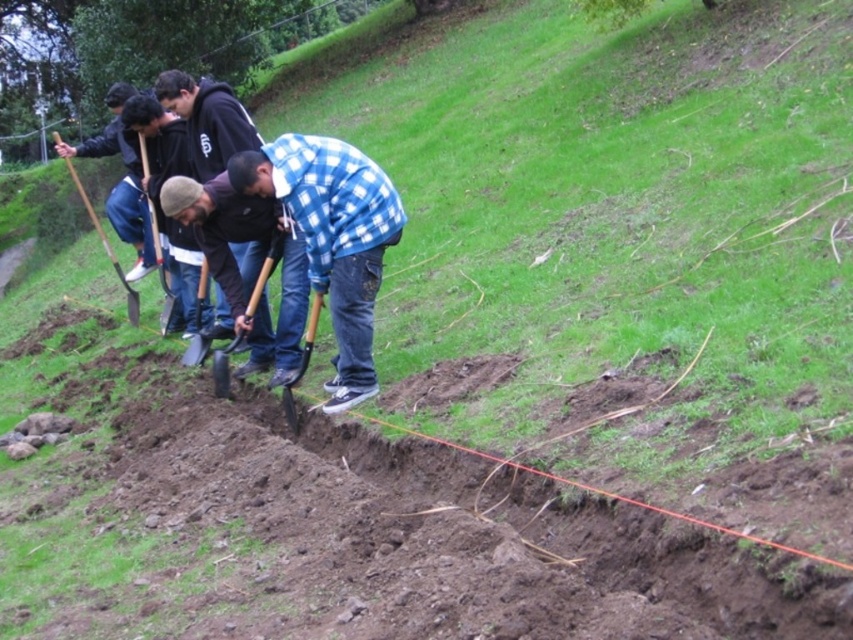
You are planning to store the metallic silver shovel at center and the wooden shovel at left in a storage compartment. Which shovel will require more space in the storage compartment?

The wooden shovel at left requires more space in the storage compartment because it occupies more space than the metallic silver shovel at center.

You are standing in front of the group of people digging on the grassy slope. There are two points marked on the slope, one at coordinates point (202, 342) and the other at point (115, 273). Which point is closer to you?

Point (202, 342) is closer to the viewer than point (115, 273).

Based on the photo, you are standing at the point with coordinates (265, 272). What object are you standing on?

You are standing on the wooden shovel at center because the point (265, 272) is located on it.